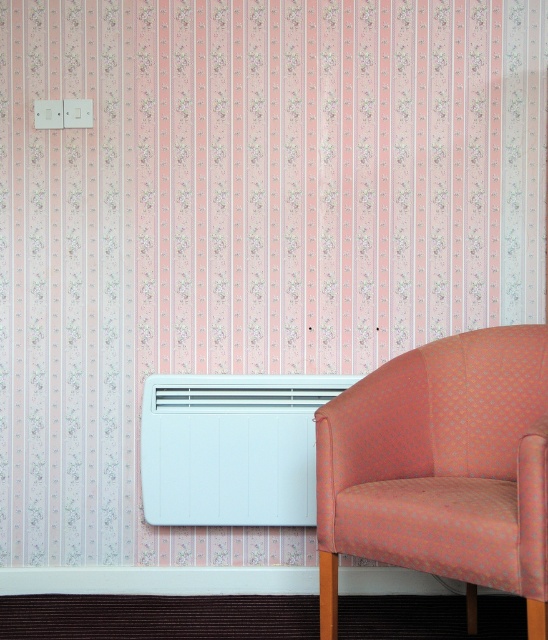
Does orange fabric armchair at lower right have a lesser height compared to white matte air conditioner at lower center?

No, orange fabric armchair at lower right is not shorter than white matte air conditioner at lower center.

Between orange fabric armchair at lower right and white matte air conditioner at lower center, which one is positioned lower?

white matte air conditioner at lower center is lower down.

Who is more distant from viewer, (x=316, y=412) or (x=284, y=436)?

Point (x=284, y=436)

You are a GUI agent. You are given a task and a screenshot of the screen. Output one action in this format:
    pyautogui.click(x=<x>, y=<y>)
    Task: Click on the orange fabric armchair at lower right
    Image resolution: width=548 pixels, height=640 pixels.
    Given the screenshot: What is the action you would take?
    pyautogui.click(x=442, y=468)